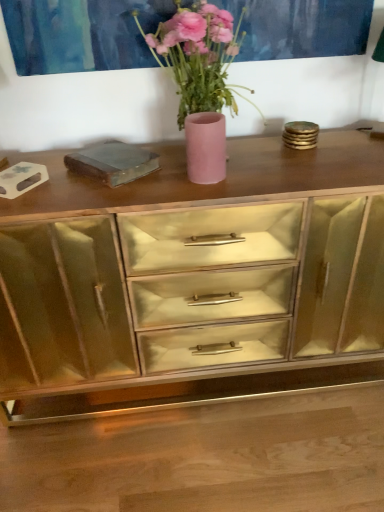
What are the coordinates of `empty space that is to the right of matte pink vase at center` in the screenshot? It's located at (272, 170).